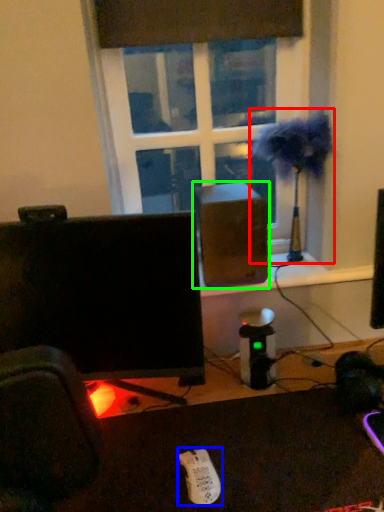
Question: Which is nearer to the table lamp (highlighted by a red box)? Wii controller (highlighted by a blue box) or speaker (highlighted by a green box).

Choices:
 (A) Wii controller
 (B) speaker

Answer: (B)